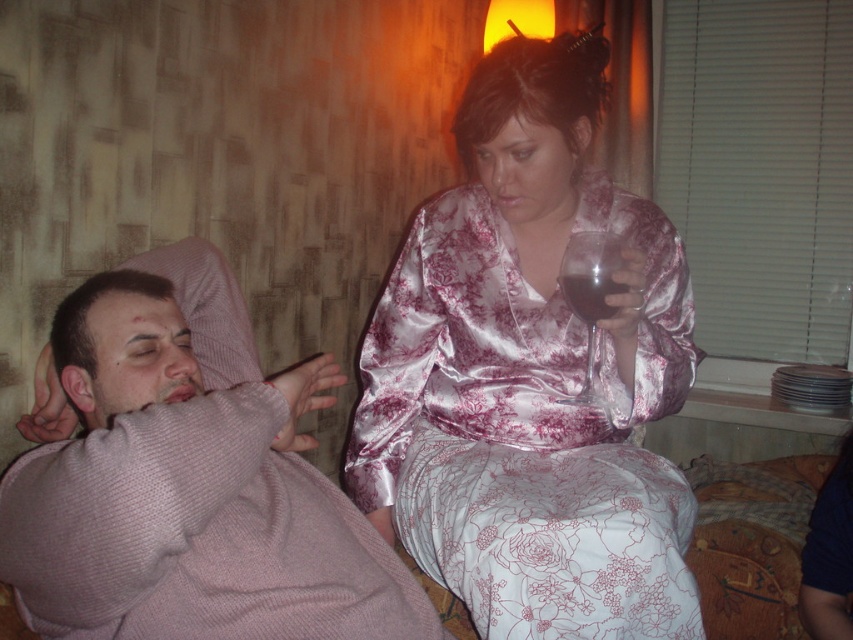
Does point (486, 288) come in front of point (608, 273)?

No, it is not.

Looking at this image, who is positioned more to the left, satin floral dress at upper center or transparent glass at upper center?

Positioned to the left is satin floral dress at upper center.

What do you see at coordinates (531, 376) in the screenshot? I see `satin floral dress at upper center` at bounding box center [531, 376].

This screenshot has width=853, height=640. I want to click on satin floral dress at upper center, so click(531, 376).

What do you see at coordinates (531, 376) in the screenshot?
I see `satin floral dress at upper center` at bounding box center [531, 376].

Which is more to the left, satin floral dress at upper center or pink knitted sweater at left?

Positioned to the left is pink knitted sweater at left.

Who is more distant from viewer, (x=680, y=371) or (x=194, y=472)?

Positioned behind is point (x=680, y=371).

The width and height of the screenshot is (853, 640). Find the location of `satin floral dress at upper center`. satin floral dress at upper center is located at coordinates (531, 376).

Which is above, transparent glass at upper center or dark glass at upper center?

dark glass at upper center

Does transparent glass at upper center have a lesser width compared to dark glass at upper center?

No, transparent glass at upper center is not thinner than dark glass at upper center.

Is point (610, 232) positioned in front of point (564, 273)?

No, (610, 232) is behind (564, 273).

Where is `transparent glass at upper center`? This screenshot has height=640, width=853. transparent glass at upper center is located at coordinates (590, 300).